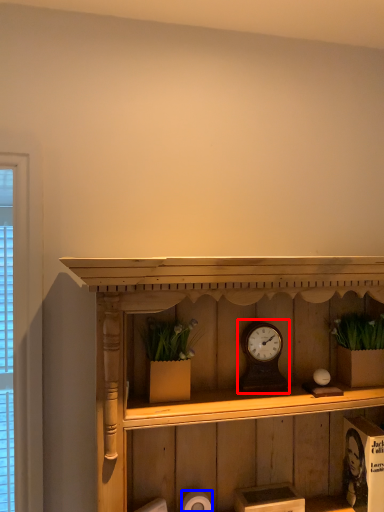
Question: Which object appears farthest to the camera in this image, alarm clock (highlighted by a red box) or toilet paper (highlighted by a blue box)?

Choices:
 (A) alarm clock
 (B) toilet paper

Answer: (A)